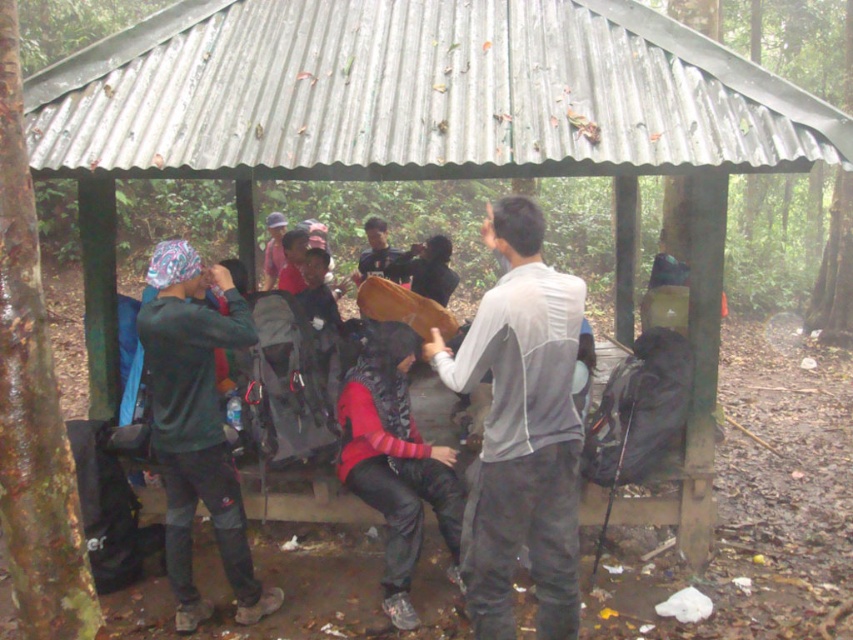
Question: Can you confirm if gray matte shirt at center is wider than dark gray fabric shirt at center?

Choices:
 (A) yes
 (B) no

Answer: (A)

Question: Among these points, which one is nearest to the camera?

Choices:
 (A) [381, 236]
 (B) [169, 484]
 (C) [379, 365]

Answer: (B)

Question: Which point appears closest to the camera in this image?

Choices:
 (A) (550, 464)
 (B) (363, 275)

Answer: (A)

Question: Which point appears closest to the camera in this image?

Choices:
 (A) pyautogui.click(x=177, y=246)
 (B) pyautogui.click(x=555, y=433)
 (C) pyautogui.click(x=421, y=460)
 (D) pyautogui.click(x=393, y=264)

Answer: (B)

Question: Is dark green fabric jacket at left smaller than dark gray fabric shirt at center?

Choices:
 (A) yes
 (B) no

Answer: (B)

Question: Does gray matte shirt at center appear over dark green fabric jacket at left?

Choices:
 (A) no
 (B) yes

Answer: (B)